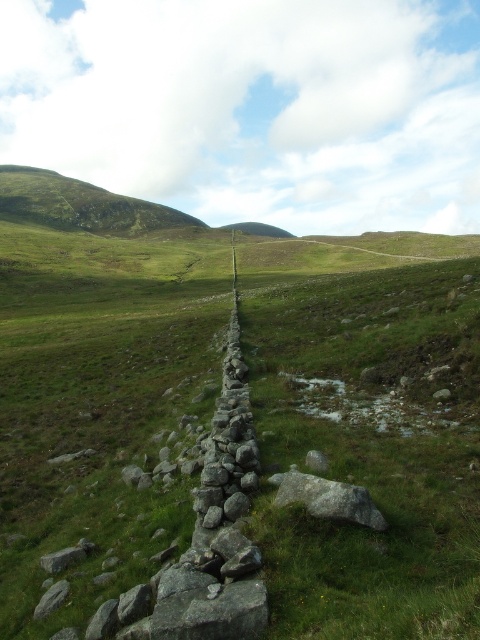
Question: Which of the following is the closest to the observer?

Choices:
 (A) gray rough stone at lower left
 (B) gray rough rock at center

Answer: (B)

Question: Does gray rough rock at center have a greater width compared to gray rough stone at lower left?

Choices:
 (A) no
 (B) yes

Answer: (B)

Question: In this image, where is gray rough rock at center located relative to gray rough stone at lower left?

Choices:
 (A) above
 (B) below

Answer: (A)

Question: Is gray rough rock at center smaller than gray rough stone at lower left?

Choices:
 (A) yes
 (B) no

Answer: (B)